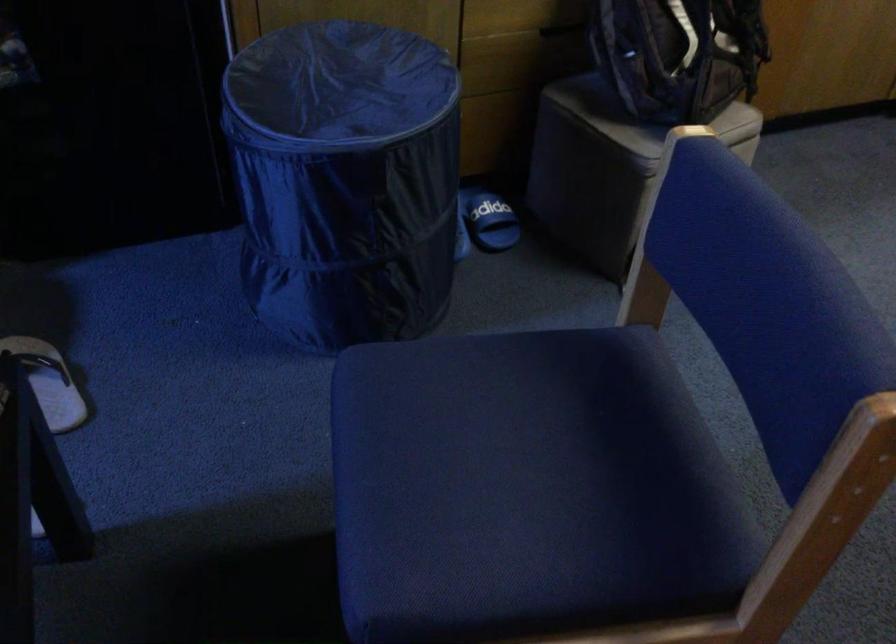
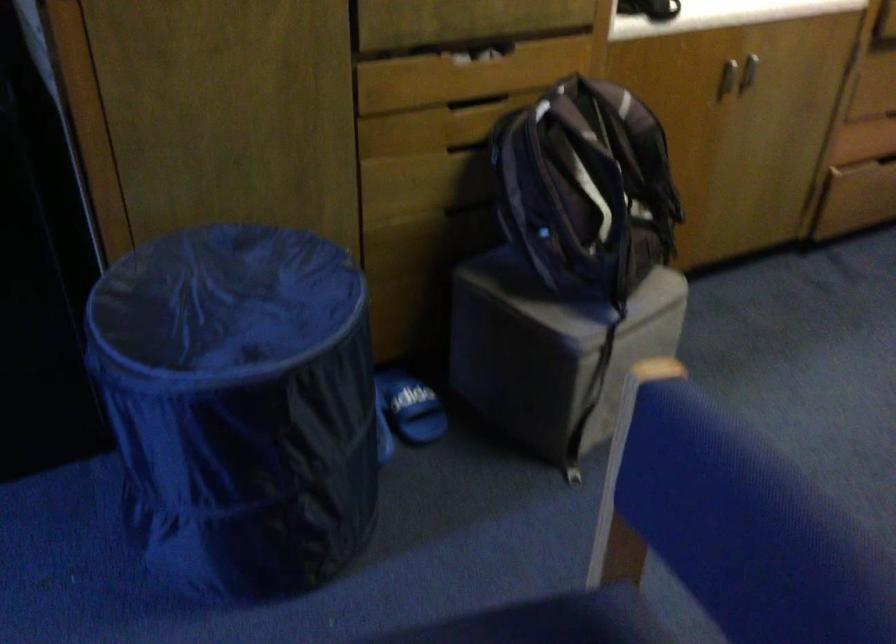
The point at (x=343, y=169) is marked in the first image. Where is the corresponding point in the second image?

(238, 406)